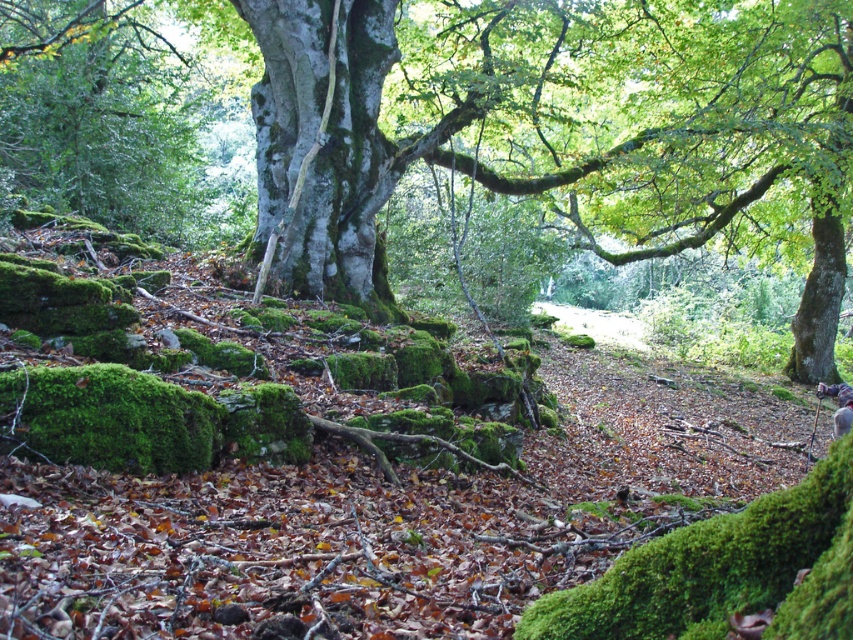
Does green mossy tree at center appear on the right side of smooth gray bark at center?

Yes, green mossy tree at center is to the right of smooth gray bark at center.

Between green mossy tree at center and smooth gray bark at center, which one has more height?

green mossy tree at center

Does point (590, 10) come farther from viewer compared to point (277, 147)?

Yes.

Identify the location of green mossy tree at center. The height and width of the screenshot is (640, 853). (592, 129).

Is smooth gray bark at center in front of camouflage fabric person at lower right?

Yes.

Is smooth gray bark at center taller than camouflage fabric person at lower right?

Yes.

Which is in front, point (372, 208) or point (851, 401)?

Point (372, 208)

At what (x,y) coordinates should I click in order to perform the action: click on smooth gray bark at center. Please return your answer as a coordinate pair (x, y). Image resolution: width=853 pixels, height=640 pixels. Looking at the image, I should click on (323, 141).

Who is positioned more to the left, green mossy tree at center or camouflage fabric person at lower right?

Positioned to the left is green mossy tree at center.

Between green mossy tree at center and camouflage fabric person at lower right, which one is positioned lower?

camouflage fabric person at lower right is lower down.

Is point (41, 134) closer to camera compared to point (840, 428)?

That is False.

The image size is (853, 640). I want to click on green mossy tree at center, so click(592, 129).